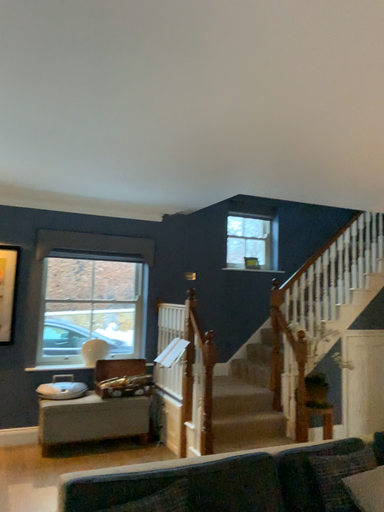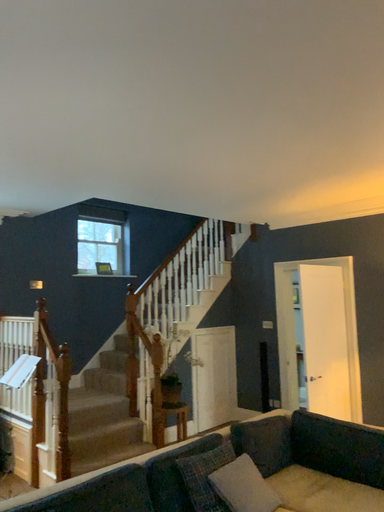
Question: Which way did the camera rotate in the video?

Choices:
 (A) rotated right
 (B) rotated left

Answer: (A)